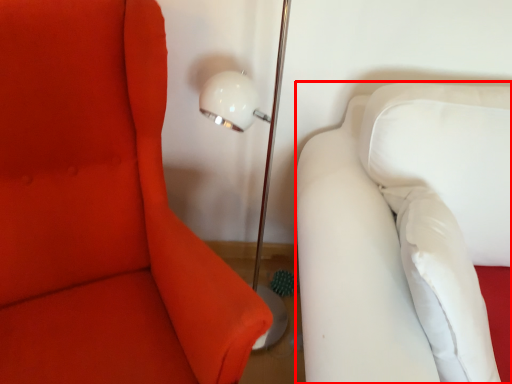
Question: In this image, where is furniture (annotated by the red box) located relative to furniture?

Choices:
 (A) right
 (B) left

Answer: (A)